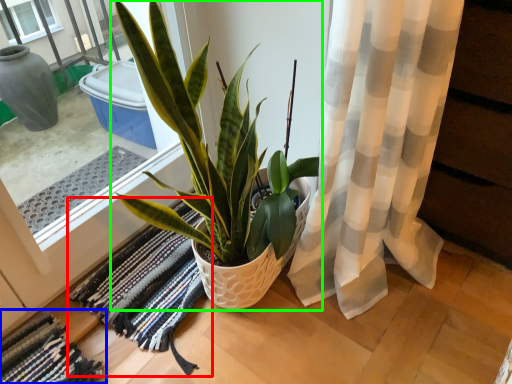
Question: Based on their relative distances, which object is farther from bath mat (highlighted by a red box)? Choose from bath mat (highlighted by a blue box) and houseplant (highlighted by a green box).

Choices:
 (A) bath mat
 (B) houseplant

Answer: (B)